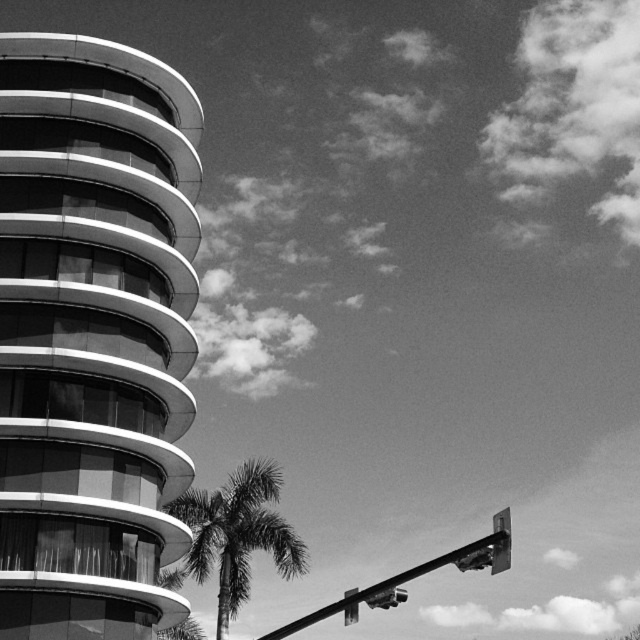
You are a photographer trying to capture the silvery textured palm tree at center and the metallic street sign at upper right in a single frame. Based on their positions, will the palm tree appear above or below the street sign in your photo?

The silvery textured palm tree at center is located below the metallic street sign at upper right, so it will appear below the street sign in the photo.

You are standing at the point marked by the coordinates point (236, 534) in the image. Looking around, you see the modern architectural structure on the left and the traffic light arm extending to the right. Which direction should you walk to reach the modern architectural structure on the left?

Since you are at point (236, 534), which represents the silvery textured palm tree at center, you should walk to the left to reach the modern architectural structure on the left.

You are standing in front of the architectural structure and want to determine the relative positions of two points in the image. Which of the two points, point (x=241, y=561) or point (x=502, y=525), is closer to you?

Point (x=241, y=561) is closer to you because it is further to the viewer than point (x=502, y=525).